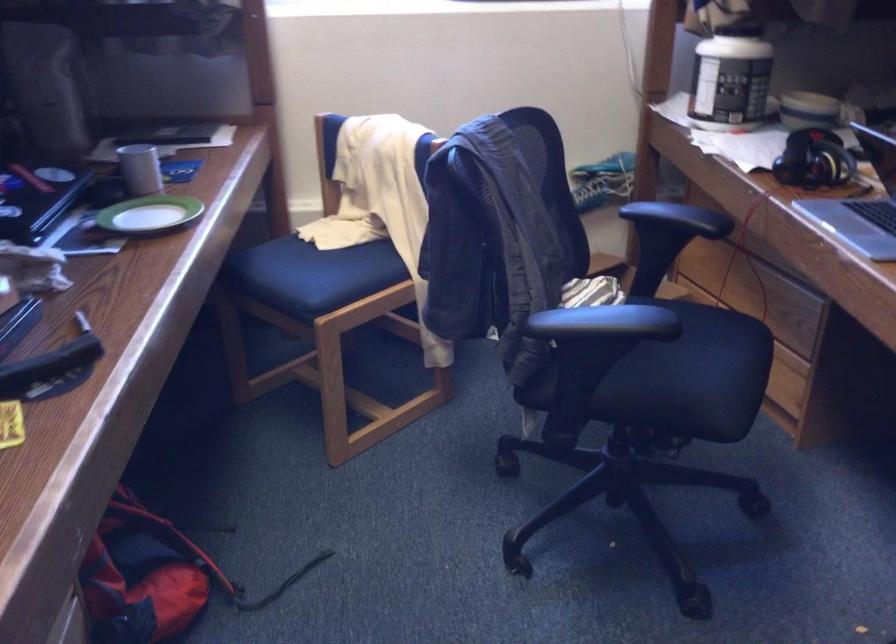
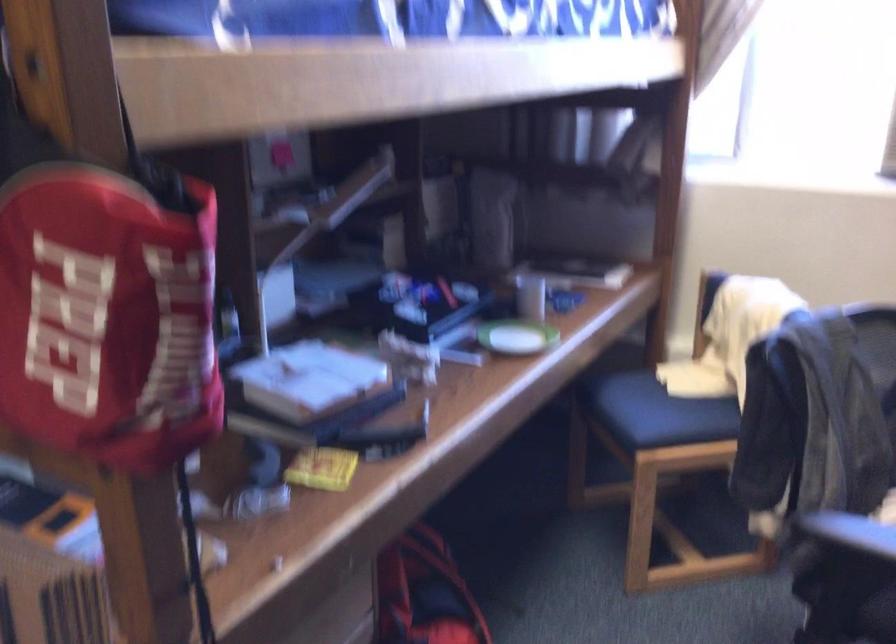
Where in the second image is the point corresponding to (153,213) from the first image?

(515, 337)